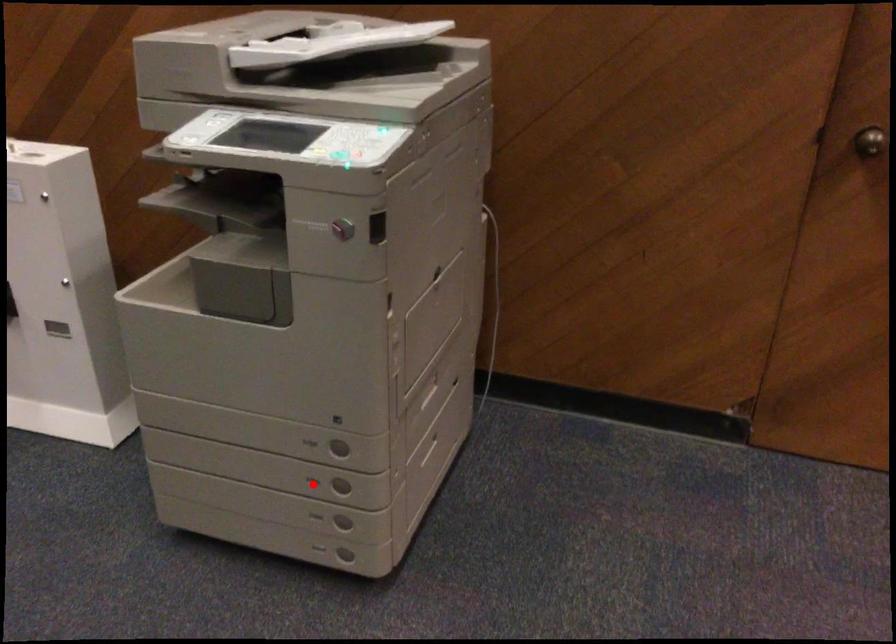
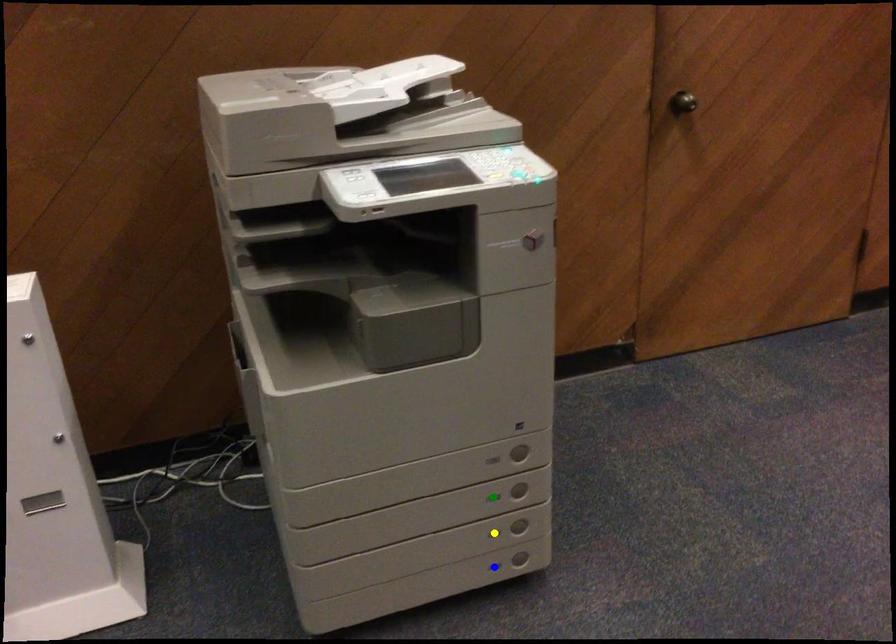
Question: I am providing you with two images of the same scene from different viewpoints. A red point is marked on the first image. You are given multiple points on the second image. Which point in image 2 represents the same 3d spot as the red point in image 1?

Choices:
 (A) yellow point
 (B) green point
 (C) blue point

Answer: (B)